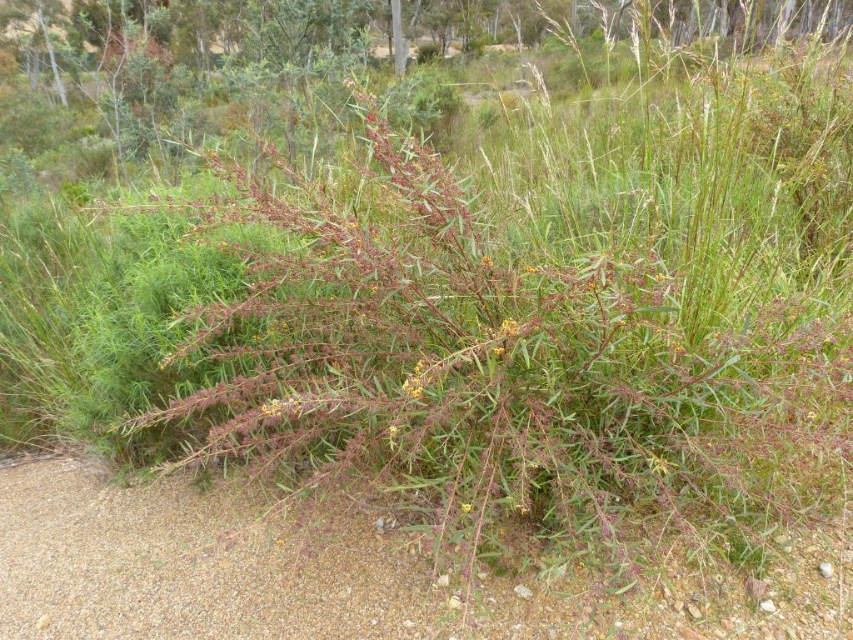
Question: Observing the image, what is the correct spatial positioning of gray gravel at lower left in reference to yellow-green flower at center?

Choices:
 (A) left
 (B) right

Answer: (A)

Question: Is the position of gray gravel at lower left more distant than that of yellow-green flower at center?

Choices:
 (A) no
 (B) yes

Answer: (B)

Question: Which object is closer to the camera taking this photo?

Choices:
 (A) yellow-green flower at center
 (B) gray gravel at lower left

Answer: (A)

Question: Does gray gravel at lower left appear on the left side of yellow-green flower at center?

Choices:
 (A) yes
 (B) no

Answer: (A)

Question: Which point appears closest to the camera in this image?

Choices:
 (A) (184, 504)
 (B) (277, 406)

Answer: (B)